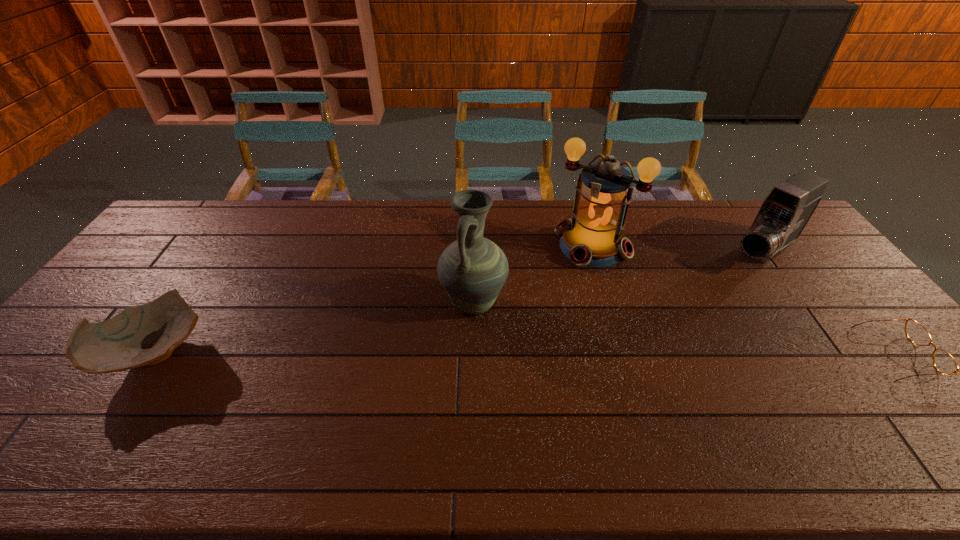
Where is `vacant region between the third shortest object and the fourth object from right to left`? This screenshot has height=540, width=960. vacant region between the third shortest object and the fourth object from right to left is located at coordinates (618, 278).

The width and height of the screenshot is (960, 540). What are the coordinates of `vacant area between the third object from left to right and the shortest object` in the screenshot? It's located at (745, 300).

Where is `free space between the lantern and the third tallest object`? The image size is (960, 540). free space between the lantern and the third tallest object is located at coordinates (678, 249).

In order to click on free space between the pitcher and the camcorder in this screenshot , I will do `click(618, 278)`.

Where is `empty location between the spectacles and the lantern`? Image resolution: width=960 pixels, height=540 pixels. empty location between the spectacles and the lantern is located at coordinates (745, 300).

This screenshot has width=960, height=540. I want to click on free space between the third object from right to left and the third shortest object, so click(678, 249).

I want to click on free spot between the second object from left to right and the third shortest object, so click(618, 278).

Find the location of `vacant area that lies between the spectacles and the camcorder`. vacant area that lies between the spectacles and the camcorder is located at coordinates (830, 304).

I want to click on unoccupied area between the shortest object and the second object from left to right, so pyautogui.click(x=685, y=329).

I want to click on object that is the second closest to the leftmost object, so click(593, 237).